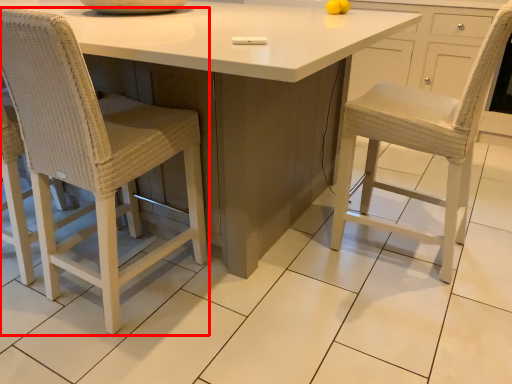
Question: From the image, what is the correct spatial relationship of chair (annotated by the red box) in relation to table?

Choices:
 (A) left
 (B) right

Answer: (B)